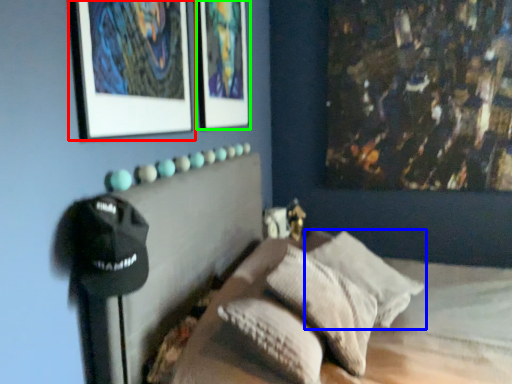
Question: Based on their relative distances, which object is farther from picture frame (highlighted by a red box)? Choose from pillow (highlighted by a blue box) and picture frame (highlighted by a green box).

Choices:
 (A) pillow
 (B) picture frame

Answer: (A)